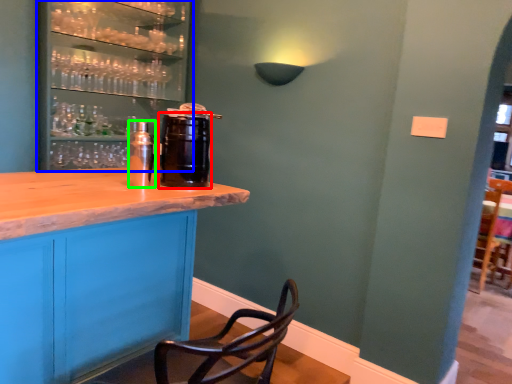
Question: Estimate the real-world distances between objects in this image. Which object is closer to beverage (highlighted by a red box), shelf (highlighted by a blue box) or beverage (highlighted by a green box)?

Choices:
 (A) shelf
 (B) beverage

Answer: (B)